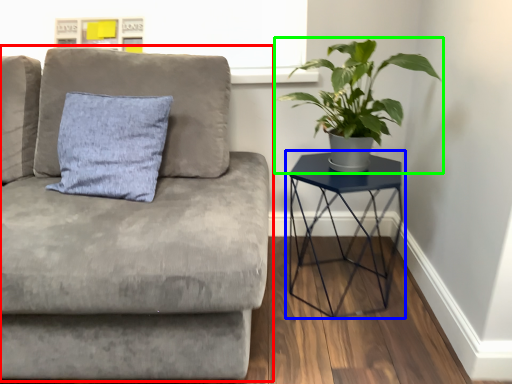
Question: Which object is positioned closest to studio couch (highlighted by a red box)? Select from table (highlighted by a blue box) and houseplant (highlighted by a green box).

Choices:
 (A) table
 (B) houseplant

Answer: (A)